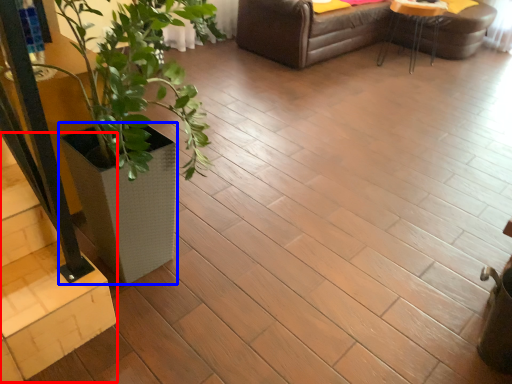
Question: Which object appears farthest to the camera in this image, stairwell (highlighted by a red box) or flowerpot (highlighted by a blue box)?

Choices:
 (A) stairwell
 (B) flowerpot

Answer: (B)